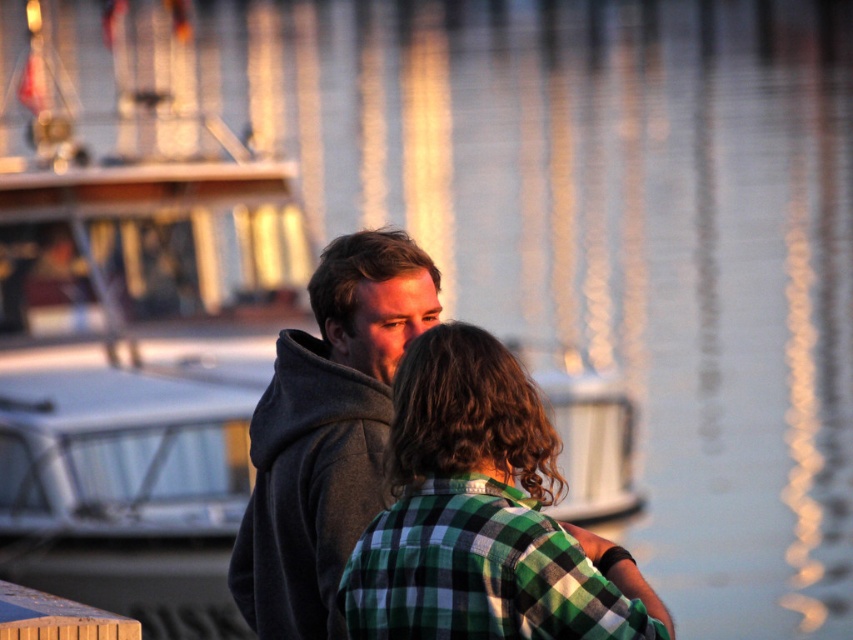
You are standing at the center of the image and want to locate the green plaid shirt at center. According to the coordinates provided, in which direction should you look relative to your position?

The green plaid shirt at center is located at coordinates 0.808 on the x axis and 0.566 on the y axis. Since the center of the image is at 0.5 on both axes, the shirt is to the right and above your current position.

You are a photographer trying to capture both the green plaid shirt at center and the gray hoodie at center in a single frame. Based on their sizes, which one should you focus on to ensure both are clearly visible?

The green plaid shirt at center is larger in size than the gray hoodie at center, so focusing on the green plaid shirt at center would help ensure both are clearly visible in the frame.